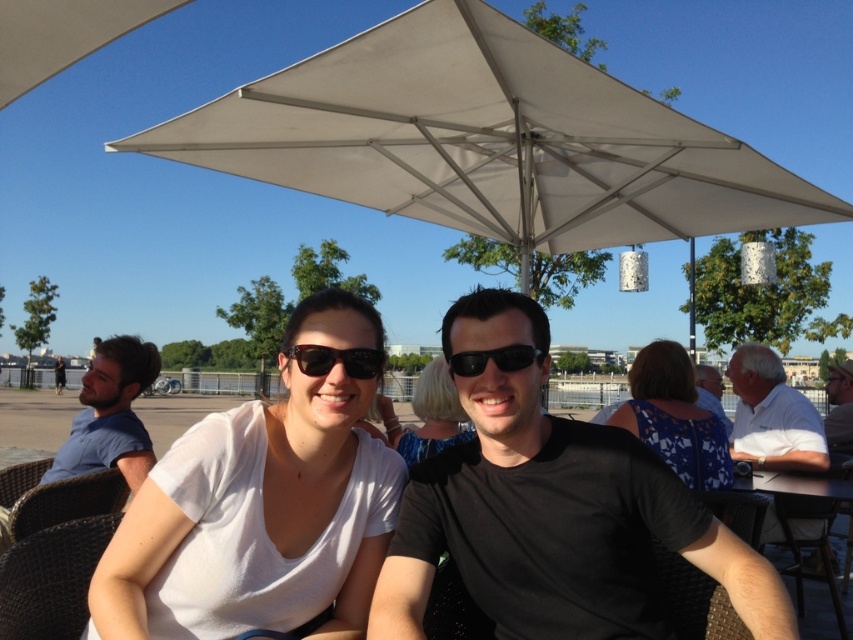
Does white matte shirt at center come in front of blonde hair at center?

That is True.

Can you confirm if white matte shirt at center is bigger than blonde hair at center?

Incorrect, white matte shirt at center is not larger than blonde hair at center.

Where is `white matte shirt at center`? white matte shirt at center is located at coordinates (254, 522).

Who is positioned more to the right, white fabric umbrella at upper center or blue cotton shirt at left?

Positioned to the right is white fabric umbrella at upper center.

Is white fabric umbrella at upper center to the left of blue cotton shirt at left from the viewer's perspective?

In fact, white fabric umbrella at upper center is to the right of blue cotton shirt at left.

Is point (618, 131) more distant than point (115, 420)?

Yes, point (618, 131) is behind point (115, 420).

Locate an element on the screen. The width and height of the screenshot is (853, 640). white fabric umbrella at upper center is located at coordinates (486, 140).

Can you confirm if blue cotton shirt at left is shorter than matte black sunglasses at center?

Incorrect, blue cotton shirt at left's height does not fall short of matte black sunglasses at center's.

Locate an element on the screen. Image resolution: width=853 pixels, height=640 pixels. blue cotton shirt at left is located at coordinates (109, 413).

What are the coordinates of `blue cotton shirt at left` in the screenshot? It's located at (109, 413).